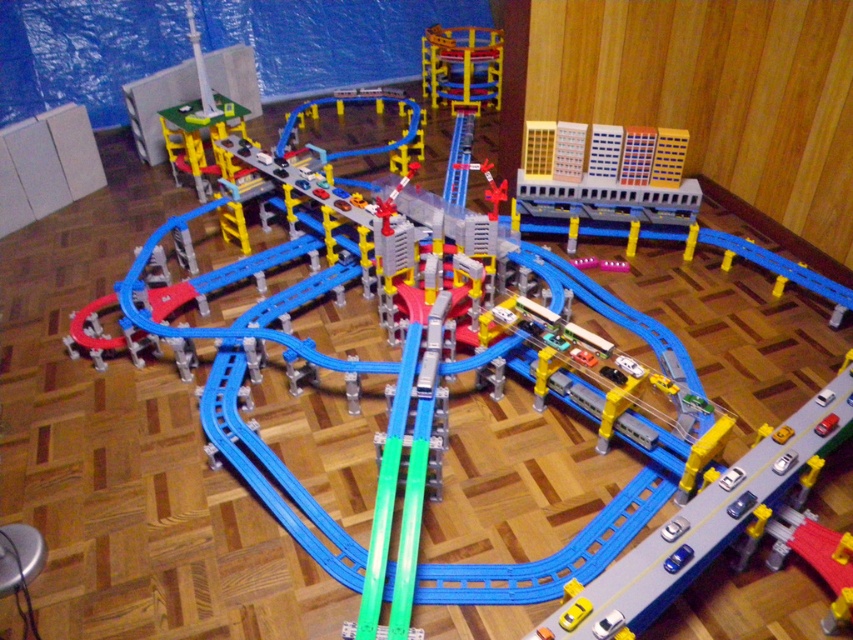
Question: Is yellow plastic building at upper right smaller than metallic blue train car at upper center?

Choices:
 (A) no
 (B) yes

Answer: (B)

Question: Is yellow plastic building at upper right closer to the viewer compared to metallic blue train car at upper center?

Choices:
 (A) yes
 (B) no

Answer: (A)

Question: Which object is positioned farthest from the metallic blue train car at upper center?

Choices:
 (A) yellow plastic building at upper right
 (B) metallic silver train at center

Answer: (B)

Question: Can you confirm if metallic silver train at center is thinner than yellow plastic building at upper right?

Choices:
 (A) yes
 (B) no

Answer: (B)

Question: Which object is positioned farthest from the yellow plastic building at upper right?

Choices:
 (A) metallic blue train car at upper center
 (B) metallic silver train at center

Answer: (A)

Question: Among these objects, which one is farthest from the camera?

Choices:
 (A) yellow plastic building at upper right
 (B) metallic blue train car at upper center

Answer: (B)